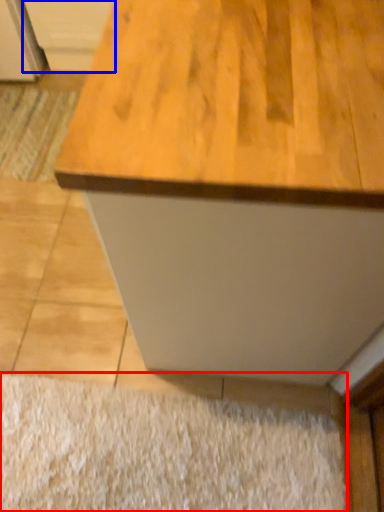
Question: Which of the following is the farthest to the observer, doormat (highlighted by a red box) or cabinetry (highlighted by a blue box)?

Choices:
 (A) doormat
 (B) cabinetry

Answer: (B)